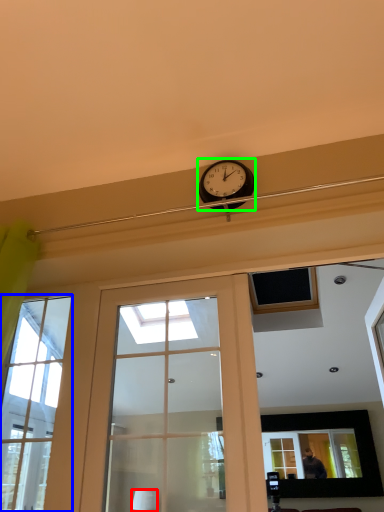
Question: Considering the real-world distances, which object is farthest from lamp (highlighted by a red box)? window (highlighted by a blue box) or clock (highlighted by a green box)?

Choices:
 (A) window
 (B) clock

Answer: (B)